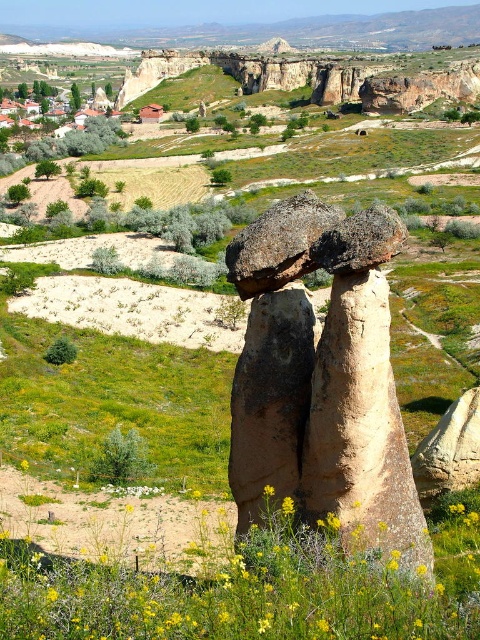
Question: Is brown textured rock formation at center wider than yellow soft textured wildflower at center?

Choices:
 (A) yes
 (B) no

Answer: (B)

Question: Is brown textured rock formation at center below yellow soft textured wildflower at center?

Choices:
 (A) yes
 (B) no

Answer: (B)

Question: Is brown textured rock formation at center smaller than yellow soft textured wildflower at center?

Choices:
 (A) yes
 (B) no

Answer: (B)

Question: Which object appears farthest from the camera in this image?

Choices:
 (A) brown textured rock formation at center
 (B) yellow soft textured wildflower at center

Answer: (A)